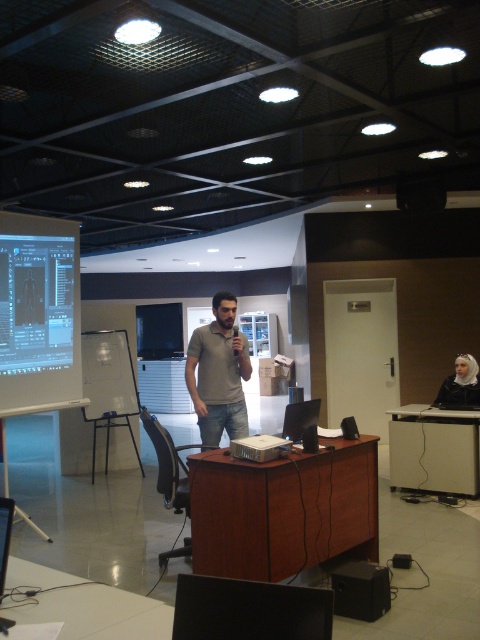
You are setting up for a presentation and need to place a laptop on the tallest table available. Which table should you choose between the brown wood table at center and the white glossy table at lower left?

The brown wood table at center is taller than the white glossy table at lower left, so you should place the laptop on the brown wood table at center.

You are organizing a small meeting and need to seat 6 people. The brown wood table at center and the white glossy table at lower left are available. Which table should you choose to accommodate everyone comfortably?

The brown wood table at center is larger than the white glossy table at lower left, so it can comfortably seat 6 people.